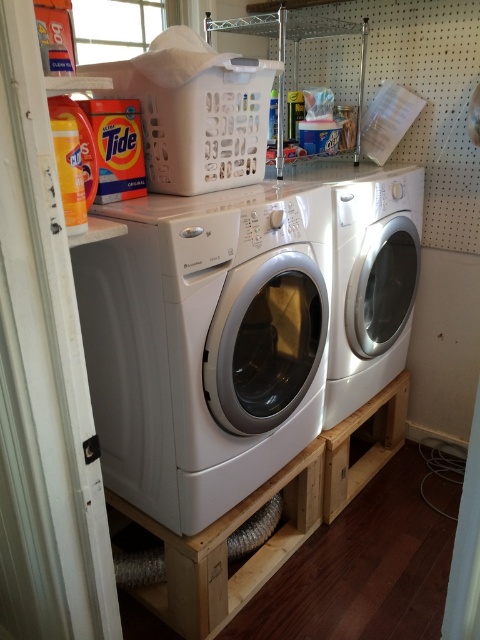
You are standing in front of the laundry appliances and notice two points marked on the wall behind them. The first point is at coordinates point (96,250) and the second point is at point (359,310). Which point is closer to your eyes?

Point (96,250) is closer to the camera than point (359,310), so the first point is closer to your eyes.

You are moving a tall box that is 1.5 meters in height. You need to place it between the white glossy washer at left and the white glossy washer at center. Considering their heights, will the box fit vertically between them?

The white glossy washer at left is taller than the white glossy washer at center. Since the box is 1.5 meters tall, it might not fit vertically between them if the shorter washer at center is less than 1.5 meters. However, without knowing the exact heights, we can only confirm the relative height difference between the two washers.

You are a delivery person holding a large package that needs to be placed in front of the white glossy washer at center. The package is 1.5 meters long. Can you place it directly in front of the washer without it extending beyond the washer?

The distance of white glossy washer at center from camera is 1.60 meters. Since the package is 1.5 meters long, it can be placed in front of the washer as it is shorter than the distance available.